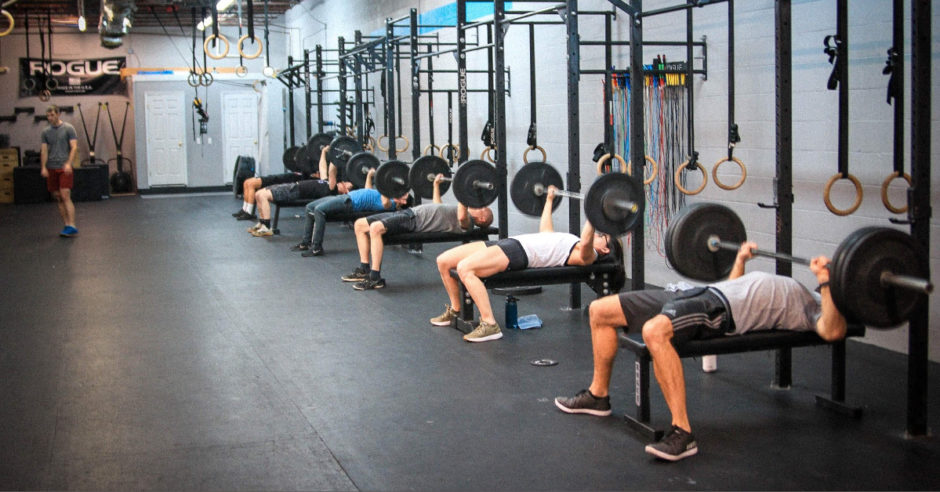
Find the location of a particular element. The image size is (940, 492). bars is located at coordinates (x=790, y=263), (x=572, y=197), (x=450, y=179), (x=367, y=168).